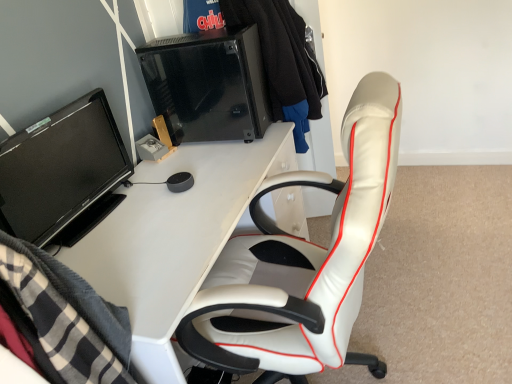
The width and height of the screenshot is (512, 384). I want to click on vacant space in black glossy monitor at left (from a real-world perspective), so click(99, 216).